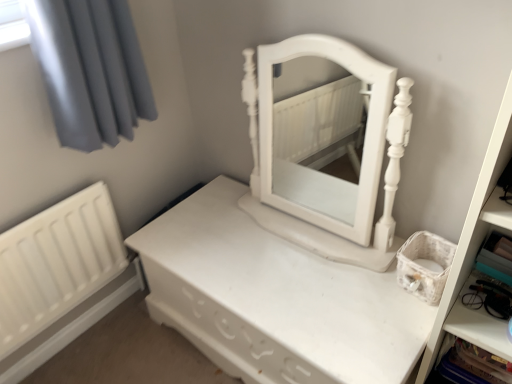
Question: In terms of height, does white matte radiator at lower left look taller or shorter compared to white plastic cabinet at lower right?

Choices:
 (A) short
 (B) tall

Answer: (B)

Question: Is white matte radiator at lower left spatially inside white plastic cabinet at lower right, or outside of it?

Choices:
 (A) inside
 (B) outside

Answer: (B)

Question: Considering the real-world distances, which object is closest to the white matte/wooden nightstand at center?

Choices:
 (A) white matte bookshelf at right
 (B) white plastic cabinet at lower right
 (C) white matte radiator at lower left

Answer: (C)

Question: Based on their relative distances, which object is farther from the white matte bookshelf at right?

Choices:
 (A) white matte/wooden nightstand at center
 (B) white matte radiator at lower left
 (C) white plastic cabinet at lower right

Answer: (B)